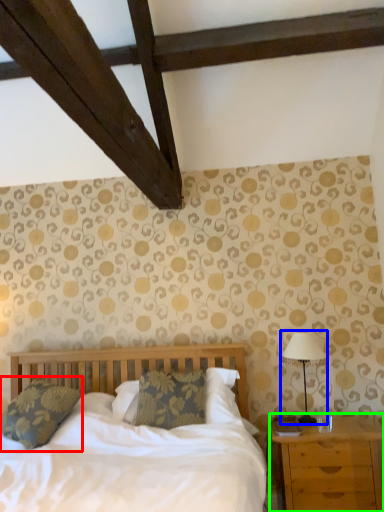
Question: Which object is the closest to the pillow (highlighted by a red box)? Choose among these: table lamp (highlighted by a blue box) or nightstand (highlighted by a green box).

Choices:
 (A) table lamp
 (B) nightstand

Answer: (B)